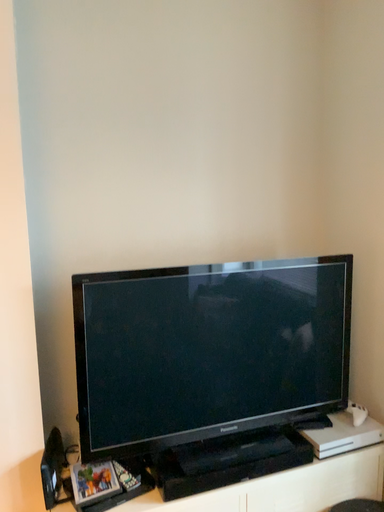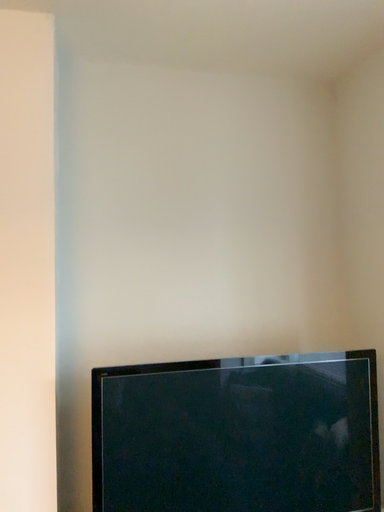
Question: Which way did the camera rotate in the video?

Choices:
 (A) rotated downward
 (B) rotated upward

Answer: (B)